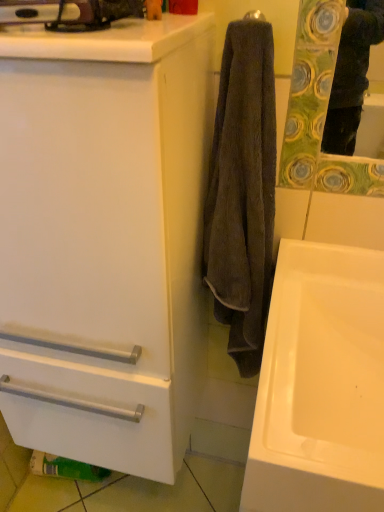
Question: From a real-world perspective, is dark brown towel at center below white matte cabinet at center?

Choices:
 (A) yes
 (B) no

Answer: (B)

Question: Is dark brown towel at center positioned before white matte cabinet at center?

Choices:
 (A) no
 (B) yes

Answer: (A)

Question: From the image's perspective, is dark brown towel at center on white matte cabinet at center?

Choices:
 (A) yes
 (B) no

Answer: (A)

Question: Can white matte cabinet at center be found inside dark brown towel at center?

Choices:
 (A) no
 (B) yes

Answer: (A)

Question: Does dark brown towel at center have a larger size compared to white matte cabinet at center?

Choices:
 (A) no
 (B) yes

Answer: (A)

Question: In terms of height, does dark brown towel at center look taller or shorter compared to white glossy sink at lower right?

Choices:
 (A) short
 (B) tall

Answer: (B)

Question: Considering the relative positions of dark brown towel at center and white glossy sink at lower right in the image provided, is dark brown towel at center to the left or to the right of white glossy sink at lower right?

Choices:
 (A) right
 (B) left

Answer: (B)

Question: From a real-world perspective, is dark brown towel at center positioned above or below white glossy sink at lower right?

Choices:
 (A) below
 (B) above

Answer: (B)

Question: Considering their positions, is dark brown towel at center located in front of or behind white glossy sink at lower right?

Choices:
 (A) front
 (B) behind

Answer: (B)

Question: Choose the correct answer: Is white glossy sink at lower right inside white matte cabinet at center or outside it?

Choices:
 (A) inside
 (B) outside

Answer: (B)

Question: From a real-world perspective, is white glossy sink at lower right positioned above or below white matte cabinet at center?

Choices:
 (A) above
 (B) below

Answer: (B)

Question: Is white glossy sink at lower right in front of or behind white matte cabinet at center in the image?

Choices:
 (A) front
 (B) behind

Answer: (B)

Question: Looking at their shapes, would you say white glossy sink at lower right is wider or thinner than white matte cabinet at center?

Choices:
 (A) wide
 (B) thin

Answer: (A)

Question: In the image, is dark brown towel at center positioned in front of or behind white matte cabinet at center?

Choices:
 (A) behind
 (B) front

Answer: (A)

Question: From the image's perspective, is dark brown towel at center located above or below white matte cabinet at center?

Choices:
 (A) below
 (B) above

Answer: (B)